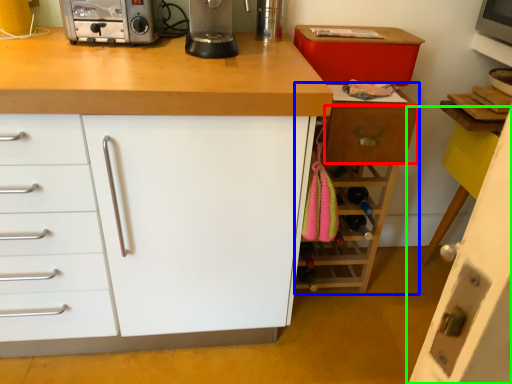
Question: Which is nearer to the drawer (highlighted by a red box)? cabinetry (highlighted by a blue box) or cabinetry (highlighted by a green box).

Choices:
 (A) cabinetry
 (B) cabinetry

Answer: (A)